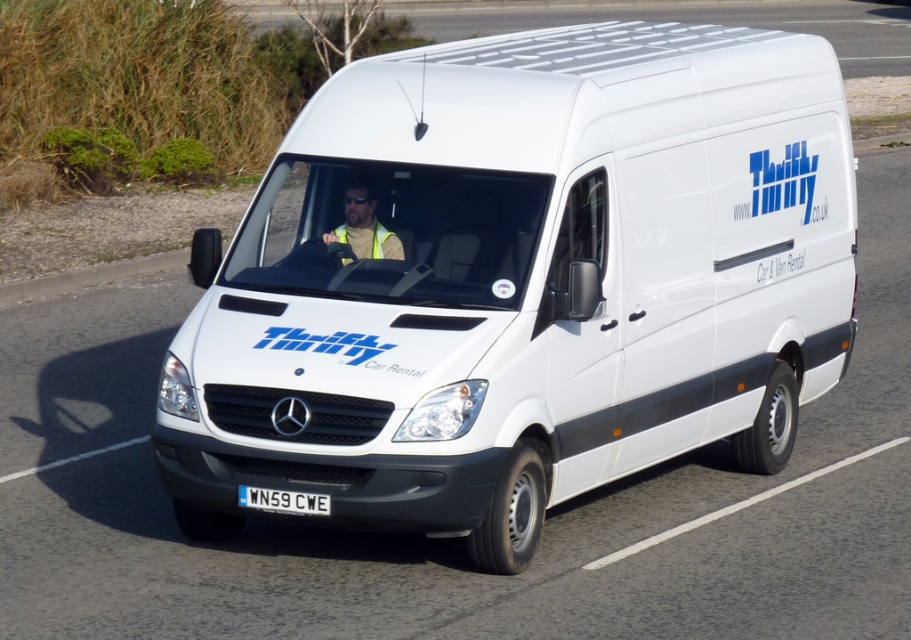
Question: Which point is farther to the camera?

Choices:
 (A) white plastic license plate at center
 (B) white matte van at center
 (C) yellow reflective vest at center

Answer: (C)

Question: Where is white matte van at center located in relation to white plastic license plate at center in the image?

Choices:
 (A) above
 (B) below

Answer: (A)

Question: Does white matte van at center appear under yellow reflective vest at center?

Choices:
 (A) yes
 (B) no

Answer: (A)

Question: Among these objects, which one is farthest from the camera?

Choices:
 (A) white matte van at center
 (B) white plastic license plate at center

Answer: (B)

Question: Which object is the farthest from the white plastic license plate at center?

Choices:
 (A) yellow reflective vest at center
 (B) white matte van at center

Answer: (B)

Question: Is white matte van at center closer to the viewer compared to yellow reflective vest at center?

Choices:
 (A) yes
 (B) no

Answer: (A)